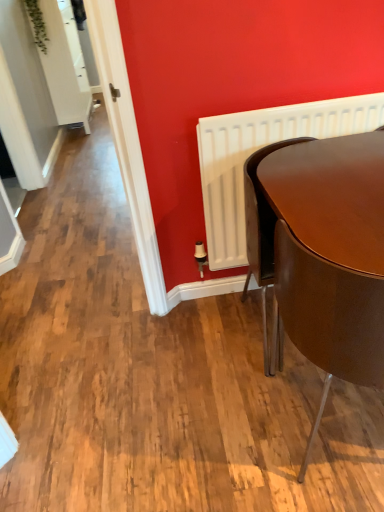
Question: Considering the relative sizes of matte brown chair at right and glossy brown table at lower right in the image provided, is matte brown chair at right bigger than glossy brown table at lower right?

Choices:
 (A) yes
 (B) no

Answer: (A)

Question: From the image's perspective, is matte brown chair at right beneath glossy brown table at lower right?

Choices:
 (A) no
 (B) yes

Answer: (B)

Question: Is matte brown chair at right to the right of glossy brown table at lower right from the viewer's perspective?

Choices:
 (A) no
 (B) yes

Answer: (B)

Question: Is matte brown chair at right oriented towards glossy brown table at lower right?

Choices:
 (A) yes
 (B) no

Answer: (A)

Question: Is matte brown chair at right not inside glossy brown table at lower right?

Choices:
 (A) no
 (B) yes

Answer: (B)

Question: From a real-world perspective, is white matte radiator at right positioned above or below matte brown chair at right?

Choices:
 (A) above
 (B) below

Answer: (A)

Question: Relative to matte brown chair at right, is white matte radiator at right in front or behind?

Choices:
 (A) front
 (B) behind

Answer: (B)

Question: Looking at the image, does white matte radiator at right seem bigger or smaller compared to matte brown chair at right?

Choices:
 (A) big
 (B) small

Answer: (B)

Question: Is point (342, 130) positioned closer to the camera than point (278, 241)?

Choices:
 (A) closer
 (B) farther

Answer: (B)

Question: From a real-world perspective, relative to white matte radiator at right, is glossy brown table at lower right vertically above or below?

Choices:
 (A) above
 (B) below

Answer: (B)

Question: Is point (324, 311) positioned closer to the camera than point (233, 184)?

Choices:
 (A) farther
 (B) closer

Answer: (B)

Question: Considering the positions of glossy brown table at lower right and white matte radiator at right in the image, is glossy brown table at lower right bigger or smaller than white matte radiator at right?

Choices:
 (A) small
 (B) big

Answer: (B)

Question: From the image's perspective, relative to white matte radiator at right, is glossy brown table at lower right above or below?

Choices:
 (A) below
 (B) above

Answer: (A)

Question: Considering the positions of white matte radiator at right and glossy brown table at lower right in the image, is white matte radiator at right bigger or smaller than glossy brown table at lower right?

Choices:
 (A) small
 (B) big

Answer: (A)

Question: From a real-world perspective, is white matte radiator at right positioned above or below glossy brown table at lower right?

Choices:
 (A) above
 (B) below

Answer: (A)